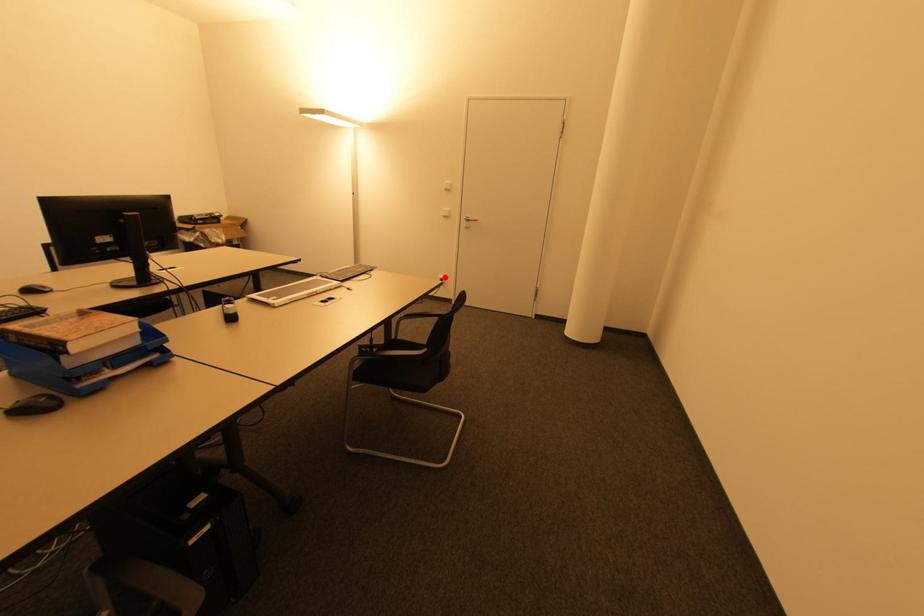
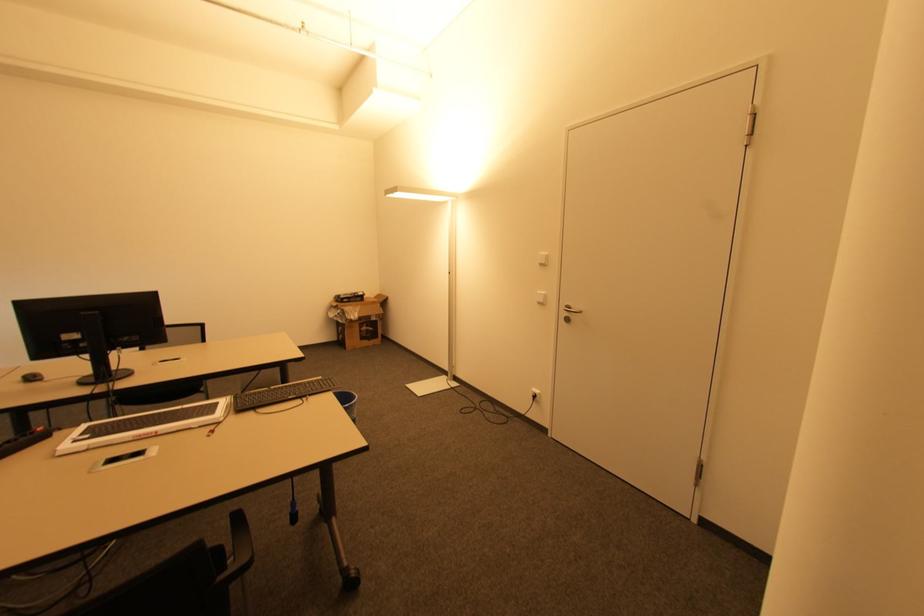
Question: I am providing you with two images of the same scene from different viewpoints. Given a red point in image1, look at the same physical point in image2. Is it:

Choices:
 (A) Closer to the viewpoint
 (B) Farther from the viewpoint

Answer: (B)